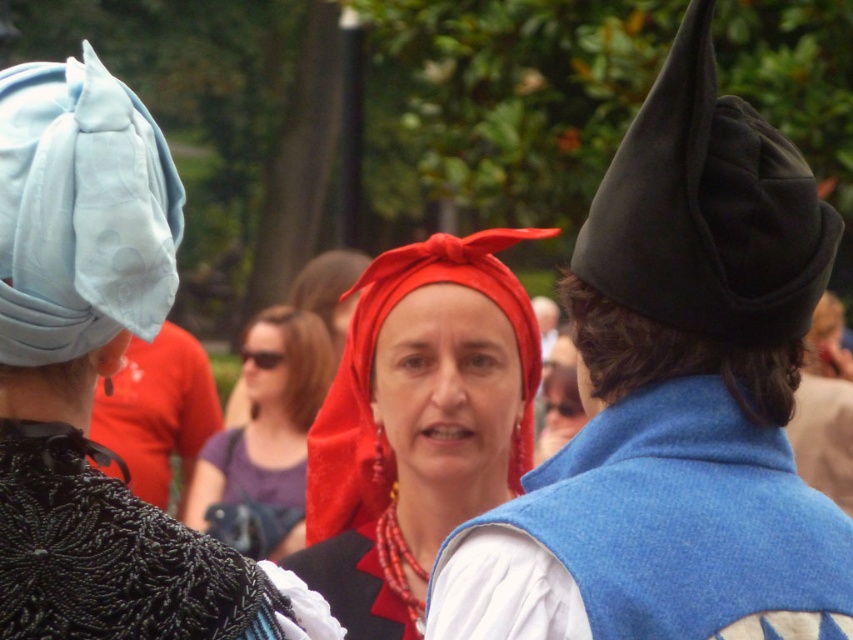
Question: Is black felt hat at upper right wider than matte black hat at left?

Choices:
 (A) no
 (B) yes

Answer: (A)

Question: Is velvet black hat at center bigger than matte red fabric headscarf at center?

Choices:
 (A) no
 (B) yes

Answer: (A)

Question: Estimate the real-world distances between objects in this image. Which object is closer to the black felt hat at upper right?

Choices:
 (A) velvet black hat at center
 (B) matte black hat at left
 (C) matte red headscarf at center
 (D) matte red fabric headscarf at center

Answer: (A)

Question: Does velvet black hat at center have a lesser width compared to matte blue fabric hat at upper left?

Choices:
 (A) no
 (B) yes

Answer: (A)

Question: Which of these objects is positioned closest to the matte blue fabric hat at upper left?

Choices:
 (A) matte red fabric headscarf at center
 (B) black felt hat at upper right
 (C) matte red headscarf at center
 (D) matte black hat at left

Answer: (B)

Question: Which point is farther to the camera?

Choices:
 (A) matte blue fabric hat at upper left
 (B) matte black hat at left

Answer: (B)